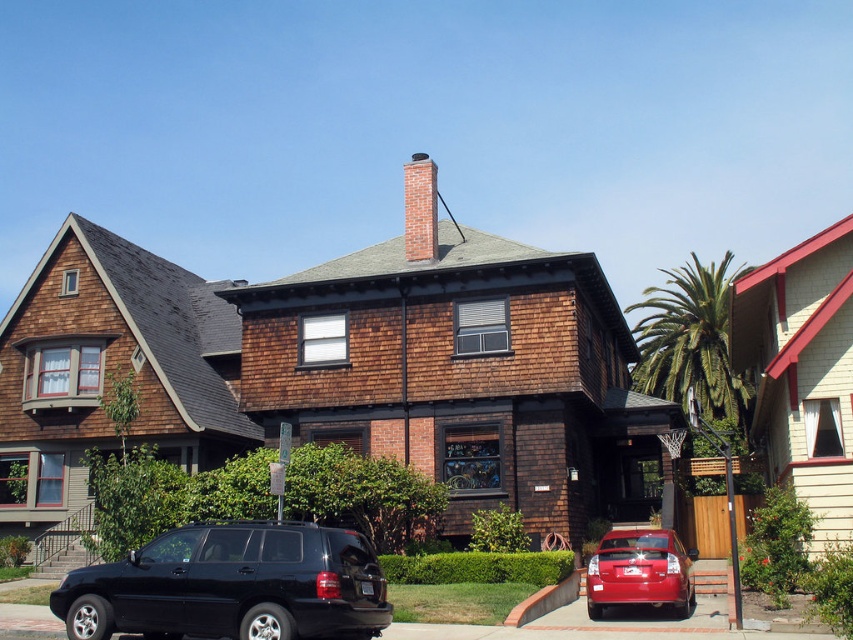
Question: Is shiny red sedan at lower right positioned at the back of brick chimney at center?

Choices:
 (A) no
 (B) yes

Answer: (A)

Question: Which object appears closest to the camera in this image?

Choices:
 (A) shiny red sedan at lower right
 (B) brick chimney at center

Answer: (A)

Question: Which object appears closest to the camera in this image?

Choices:
 (A) black matte suv at lower left
 (B) brick chimney at center

Answer: (A)

Question: Which object appears closest to the camera in this image?

Choices:
 (A) shiny red sedan at lower right
 (B) brick chimney at center

Answer: (A)

Question: Does shiny red sedan at lower right appear over brick chimney at center?

Choices:
 (A) yes
 (B) no

Answer: (B)

Question: Is black matte suv at lower left thinner than shiny red sedan at lower right?

Choices:
 (A) yes
 (B) no

Answer: (B)